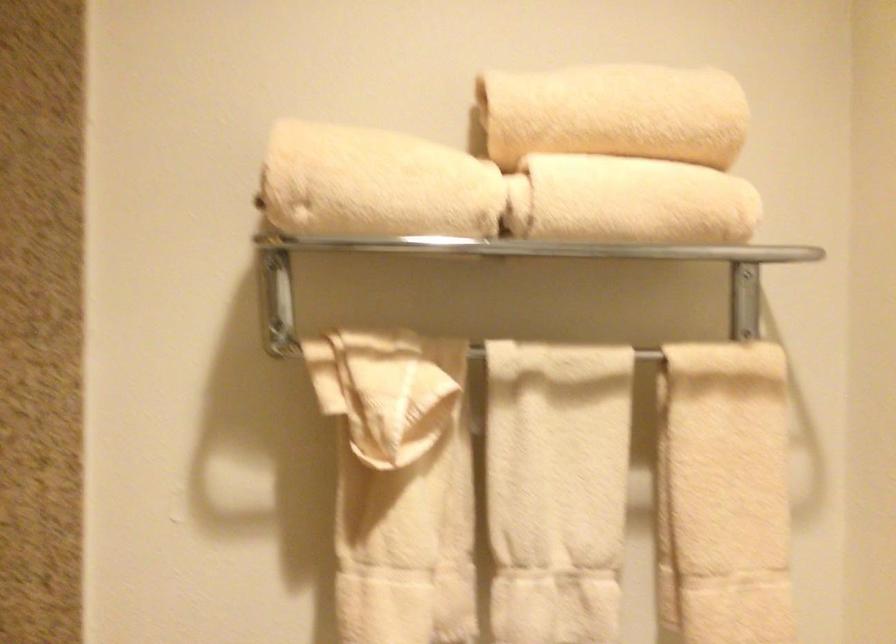
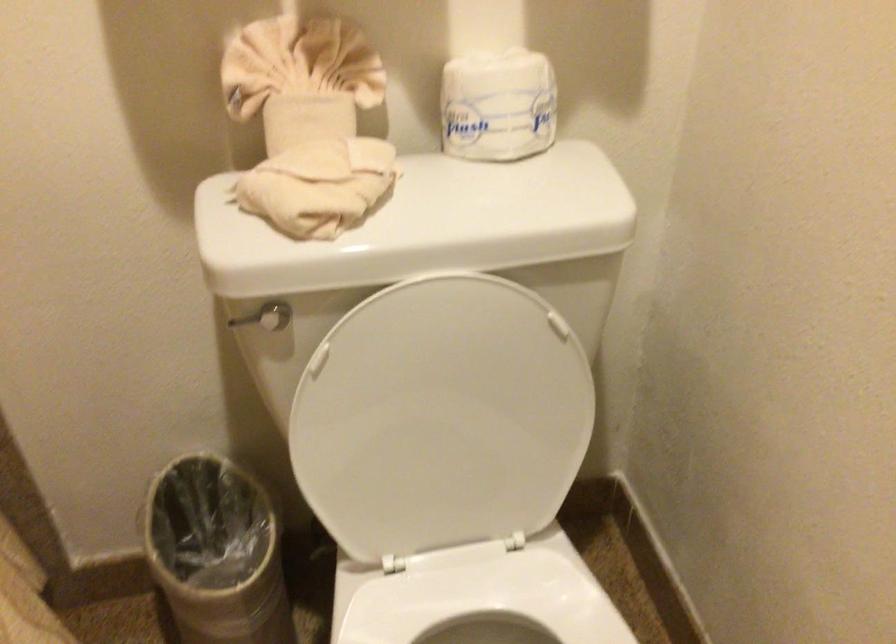
Question: How did the camera likely rotate?

Choices:
 (A) Left
 (B) Right
 (C) Up
 (D) Down

Answer: (D)